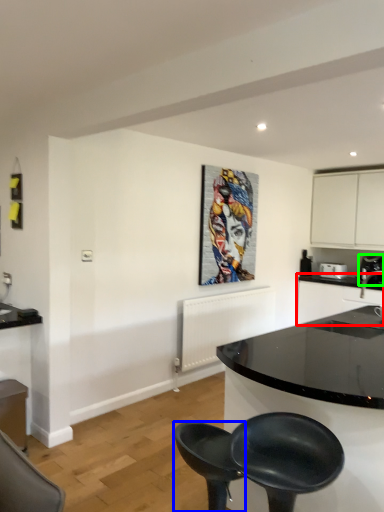
Question: Estimate the real-world distances between objects in this image. Which object is closer to counter top (highlighted by a red box), chair (highlighted by a blue box) or coffee machine (highlighted by a green box)?

Choices:
 (A) chair
 (B) coffee machine

Answer: (B)